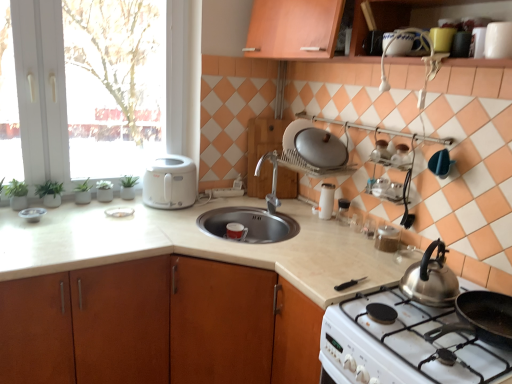
The image size is (512, 384). I want to click on free space that is to the left of metallic silver bowl at left, the 4th appliance from the front, so click(10, 211).